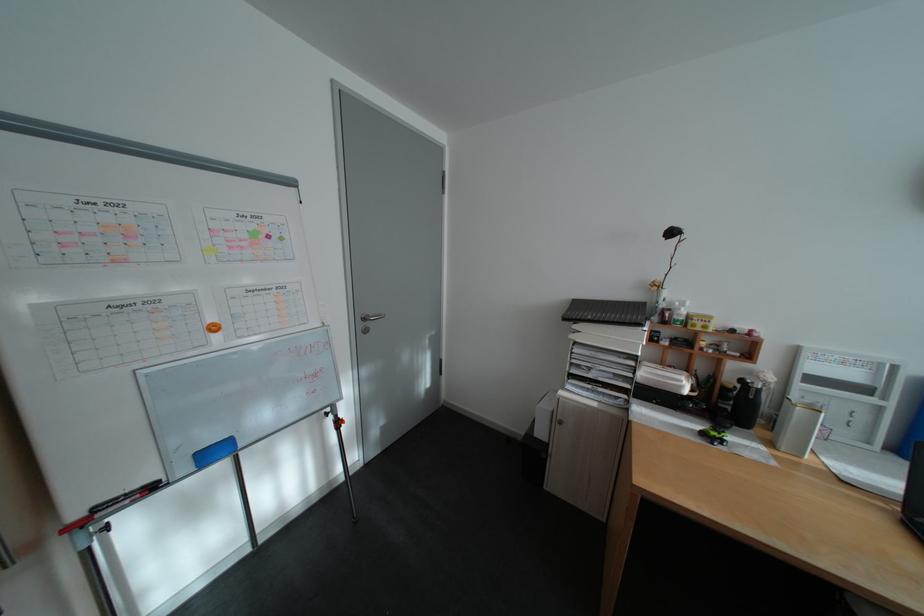
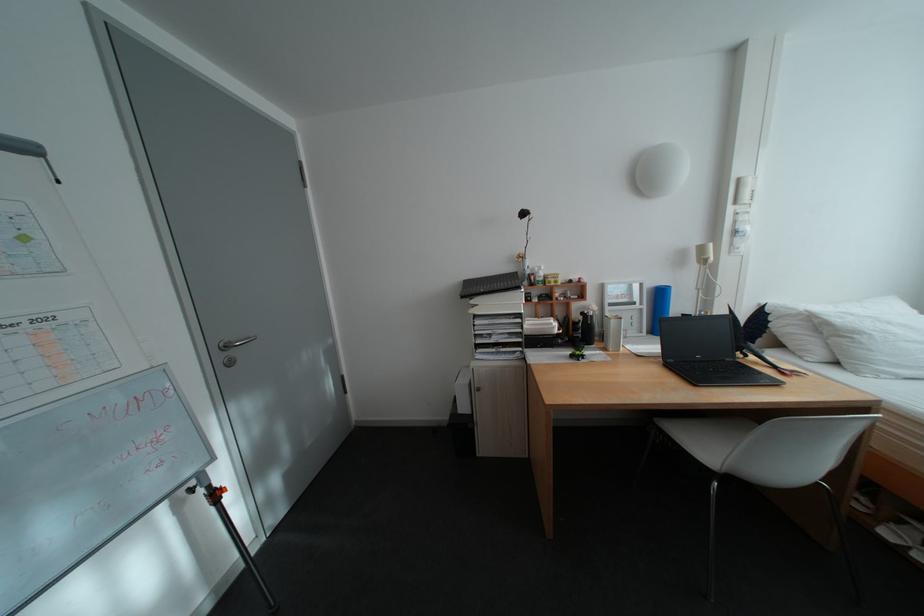
Where in the second image is the point corresponding to point 339,416 from the first image?

(203, 492)